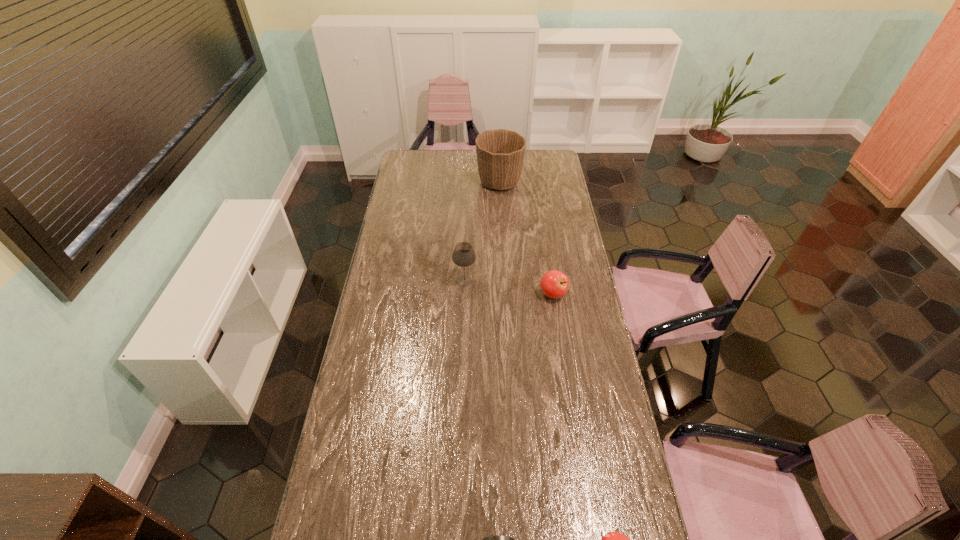
Where is `the farthest object`? This screenshot has width=960, height=540. the farthest object is located at coordinates (500, 153).

Image resolution: width=960 pixels, height=540 pixels. Identify the location of flowerpot. (500, 153).

At what (x,y) coordinates should I click in order to perform the action: click on the second tallest object. Please return your answer as a coordinate pair (x, y). Looking at the image, I should click on (463, 255).

Locate an element on the screen. The width and height of the screenshot is (960, 540). the farther apple is located at coordinates (554, 284).

Where is `free location located 0.140m on the left of the tallest object`? The height and width of the screenshot is (540, 960). free location located 0.140m on the left of the tallest object is located at coordinates (450, 182).

Find the location of a particular element. This screenshot has width=960, height=540. vacant space located 0.280m on the front of the second tallest object is located at coordinates (463, 343).

The width and height of the screenshot is (960, 540). Find the location of `free point located 0.260m on the back of the taller apple`. free point located 0.260m on the back of the taller apple is located at coordinates (545, 244).

This screenshot has width=960, height=540. I want to click on object present at the far edge, so click(x=500, y=153).

Find the location of a particular element. object that is positioned at the right edge is located at coordinates (554, 284).

Image resolution: width=960 pixels, height=540 pixels. I want to click on free space at the far edge of the desktop, so (444, 151).